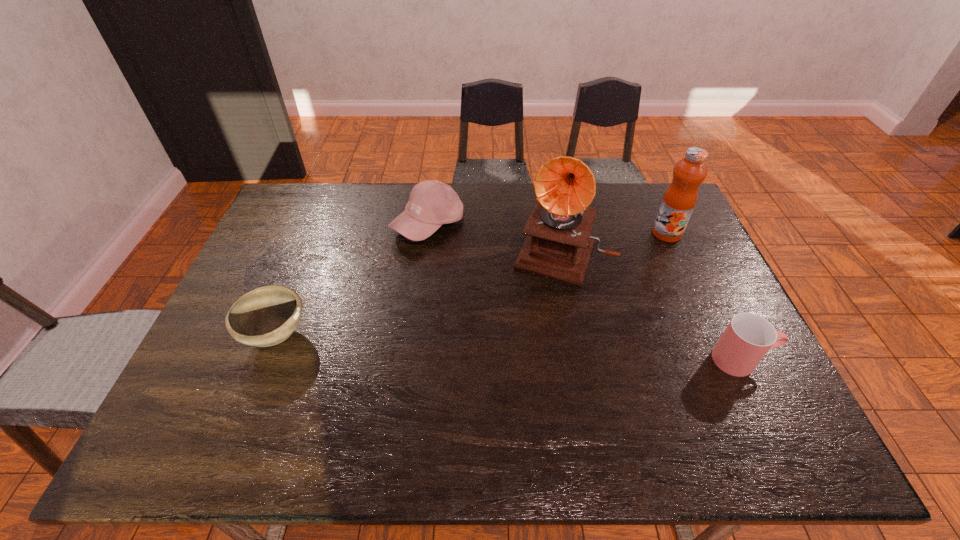
Identify the location of vacant space located on the front-facing side of the fourth object from right to left. The height and width of the screenshot is (540, 960). (465, 334).

Where is `blank area located 0.380m on the front label of the fourth shortest object`? This screenshot has height=540, width=960. blank area located 0.380m on the front label of the fourth shortest object is located at coordinates (590, 303).

Image resolution: width=960 pixels, height=540 pixels. Identify the location of vacant space located on the front label of the fourth shortest object. (641, 257).

The height and width of the screenshot is (540, 960). Find the location of `vacant area situated on the front label of the fourth shortest object`. vacant area situated on the front label of the fourth shortest object is located at coordinates (594, 300).

Find the location of `free spot located on the horn of the phonograph record`. free spot located on the horn of the phonograph record is located at coordinates (544, 299).

At what (x,y) coordinates should I click in order to perform the action: click on vacant region located 0.310m on the horn of the phonograph record. Please return your answer as a coordinate pair (x, y). Looking at the image, I should click on (519, 370).

Identify the location of blank space located on the horn of the phonograph record. (515, 384).

Where is `baseball cap located at the far edge`? Image resolution: width=960 pixels, height=540 pixels. baseball cap located at the far edge is located at coordinates (432, 203).

Image resolution: width=960 pixels, height=540 pixels. Identify the location of fruit juice located in the far edge section of the desktop. (679, 200).

This screenshot has width=960, height=540. I want to click on object that is positioned at the near edge, so click(x=748, y=337).